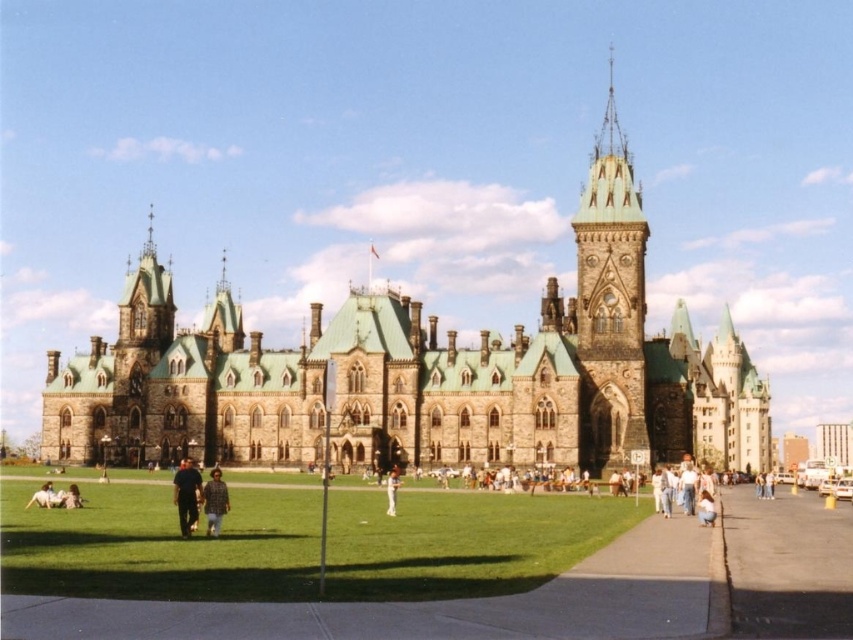
Based on the photo, you are standing in the public square in front of the historic building. You see a point marked at coordinates (186, 496). According to the image, what object is this point located on?

The point at (186, 496) is located on dark blue jeans at center.

You are a photographer standing in the public square, wanting to take a photo of the historic building. You notice two items in the foreground that might block your view. Which item, the plaid shirt at lower center or the light brown leather jacket at lower right, is taller and thus more likely to obstruct your camera lens?

The plaid shirt at lower center is taller than the light brown leather jacket at lower right, so it is more likely to obstruct your camera lens.

You are a photographer standing in the public square facing the historic building. You notice a person wearing dark blue jeans at center and white cotton shirt at center. Which piece of clothing is closer to you?

The dark blue jeans at center is in front of the white cotton shirt at center, so the dark blue jeans at center is closer to you.